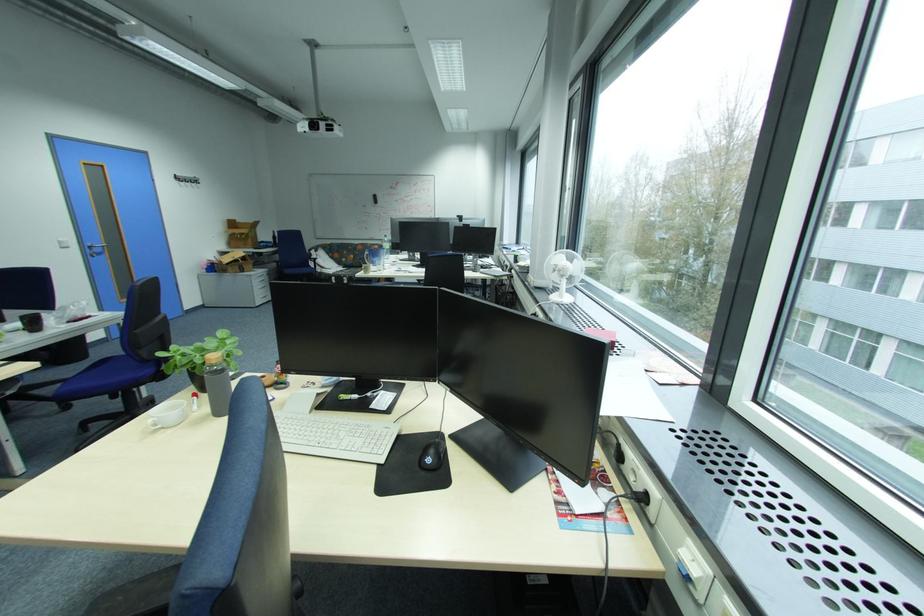
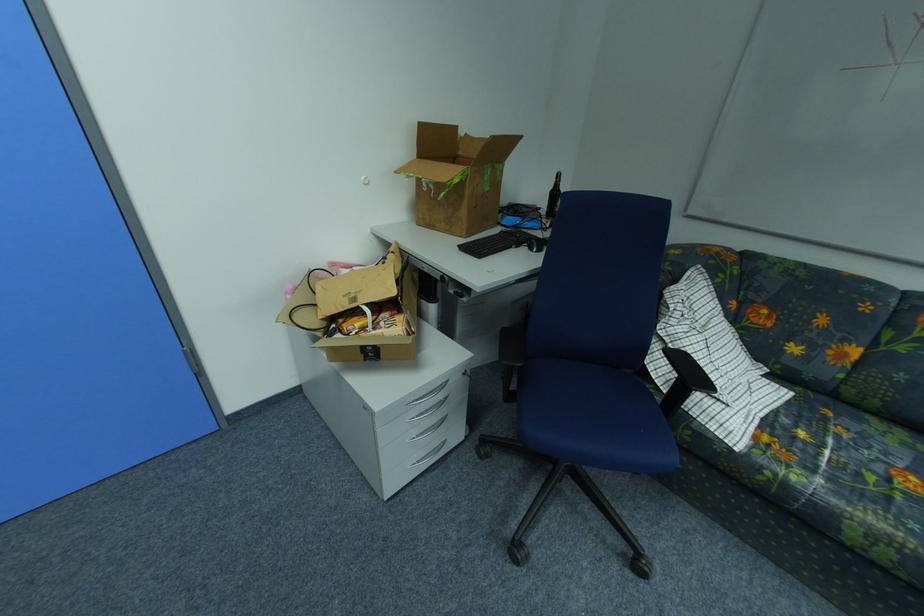
In the second image, find the point that corresponds to (259,243) in the first image.

(470, 214)